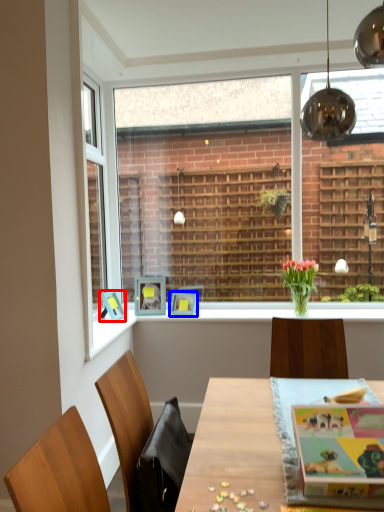
Question: Which point is further to the camera, picture frame (highlighted by a red box) or picture frame (highlighted by a blue box)?

Choices:
 (A) picture frame
 (B) picture frame

Answer: (B)